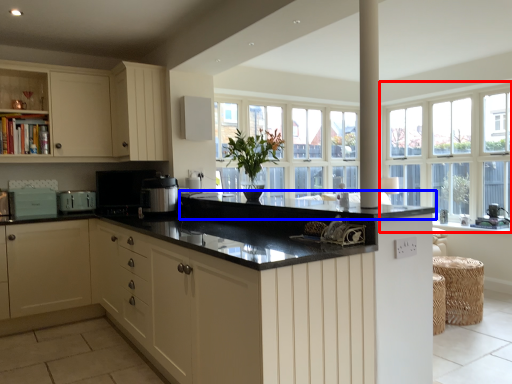
Question: Which object is further to the camera taking this photo, window (highlighted by a red box) or countertop (highlighted by a blue box)?

Choices:
 (A) window
 (B) countertop

Answer: (A)